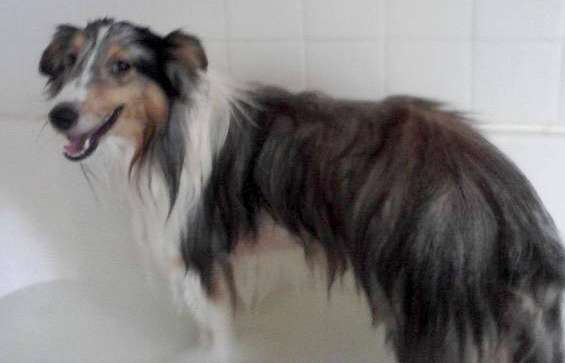
This screenshot has width=565, height=363. Identify the location of white tiles. (47, 220), (233, 33), (341, 75), (490, 65), (531, 126).